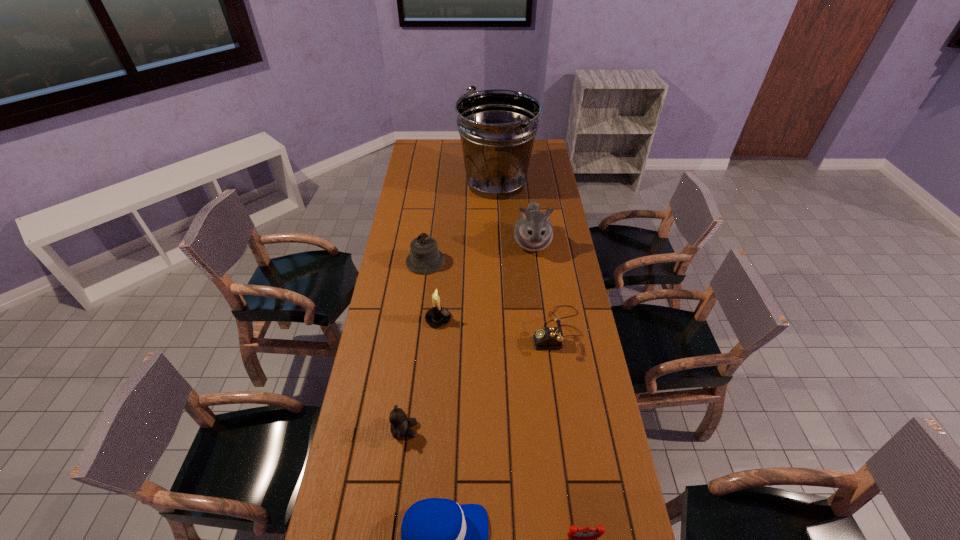
Locate an element on the screen. vacant space at the left edge of the desktop is located at coordinates (390, 489).

Find the location of a particular element. This screenshot has width=960, height=540. vacant space at the right edge of the desktop is located at coordinates (613, 461).

I want to click on vacant space at the far left corner, so click(x=430, y=144).

What are the coordinates of `empty space between the bell and the telephone` in the screenshot? It's located at (492, 295).

Identify the location of free space between the telephone and the bell. (492, 295).

Find the location of a particular element. vacant space in between the bell and the hamster is located at coordinates (479, 252).

Image resolution: width=960 pixels, height=540 pixels. I want to click on free space that is in between the hamster and the bucket, so click(x=514, y=213).

I want to click on blank region between the telephone and the second tallest object, so click(x=544, y=286).

At what (x,y) coordinates should I click in order to perform the action: click on free spot between the seventh shortest object and the candle holder. Please return your answer as a coordinate pair (x, y). The height and width of the screenshot is (540, 960). Looking at the image, I should click on click(485, 281).

Select which object appears as the closest to the alarm clock. Please provide its 2D coordinates. Your answer should be formatted as a tuple, i.e. [(x, y)], where the tuple contains the x and y coordinates of a point satisfying the conditions above.

[(440, 539)]